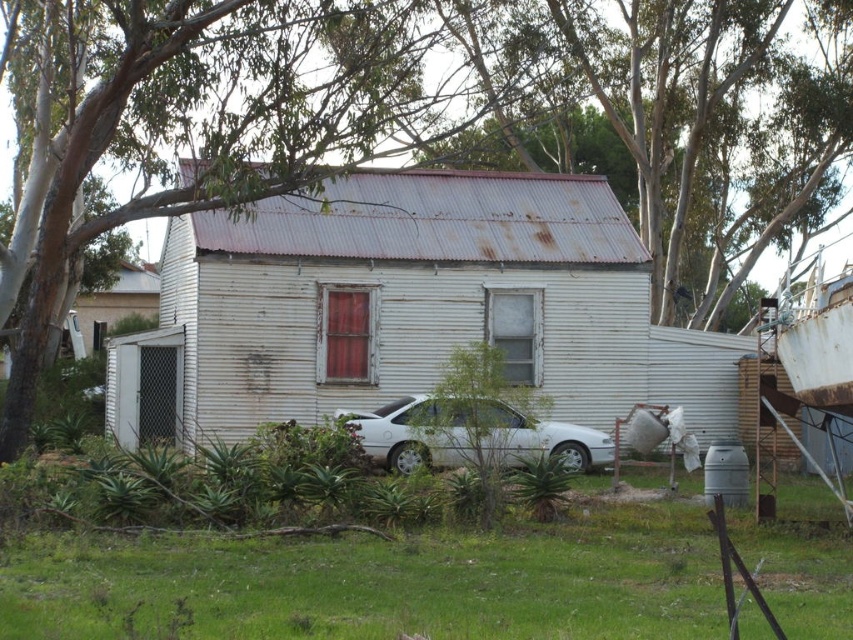
You are standing in front of the white corrugated metal house and see the green grass at lower center and the white matte car at center. Which one is wider?

The green grass at lower center might be wider than white matte car at center.

You are standing in front of the house and want to place a small potted plant. Where should you put it so that it is on the green grass at lower center?

Place the potted plant on the green grass at lower center located at the 2D coordinates point [379,582].